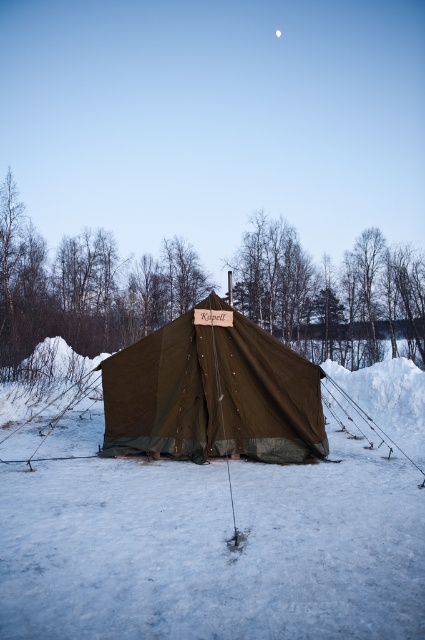
Between olive green canvas tent at center and white matte moon at upper center, which one has more height?

olive green canvas tent at center is taller.

Between olive green canvas tent at center and white matte moon at upper center, which one appears on the left side from the viewer's perspective?

olive green canvas tent at center

Identify the location of olive green canvas tent at center. (212, 396).

Between white fluffy snow at center and olive green canvas tent at center, which one appears on the right side from the viewer's perspective?

white fluffy snow at center

Between white fluffy snow at center and olive green canvas tent at center, which one is positioned lower?

white fluffy snow at center

The image size is (425, 640). What do you see at coordinates (214, 548) in the screenshot? I see `white fluffy snow at center` at bounding box center [214, 548].

Where is `white fluffy snow at center`? The width and height of the screenshot is (425, 640). white fluffy snow at center is located at coordinates (214, 548).

Is white fluffy snow at center thinner than white matte moon at upper center?

Incorrect, white fluffy snow at center's width is not less than white matte moon at upper center's.

Does white fluffy snow at center appear on the right side of white matte moon at upper center?

In fact, white fluffy snow at center is to the left of white matte moon at upper center.

Measure the distance between white fluffy snow at center and camera.

The distance of white fluffy snow at center from camera is 3.42 meters.

Find the location of a particular element. The height and width of the screenshot is (640, 425). white fluffy snow at center is located at coordinates (214, 548).